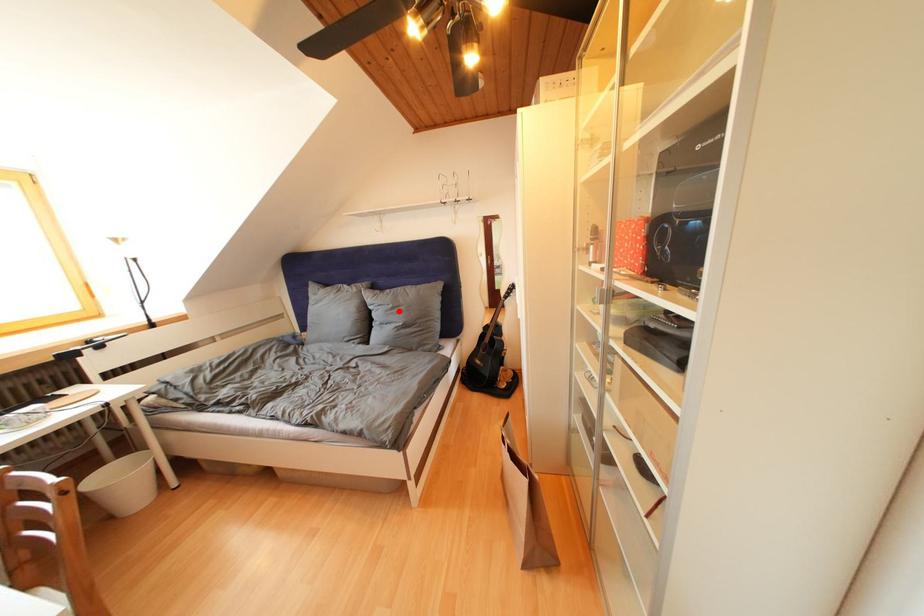
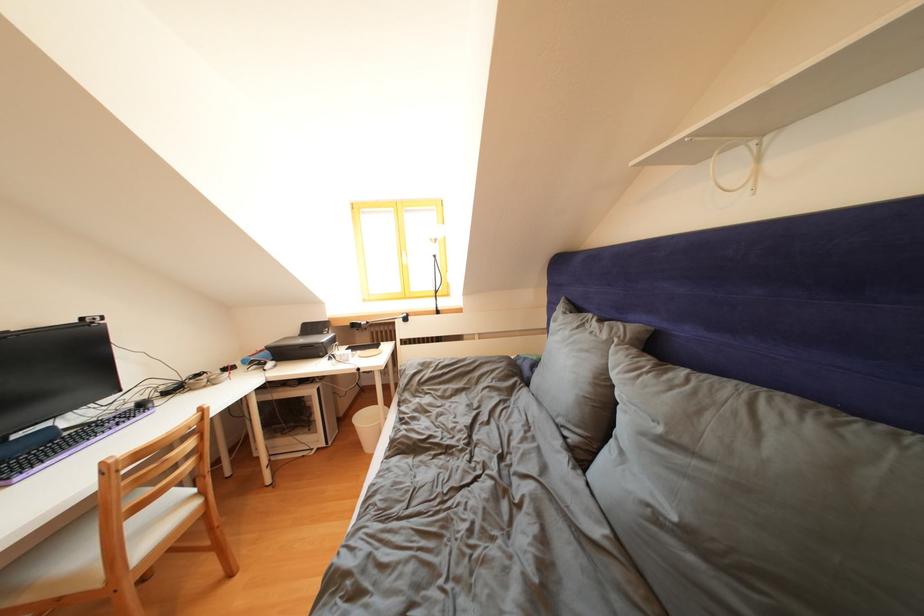
Question: I am providing you with two images of the same scene from different viewpoints. In image1, a red point is highlighted. Considering the same 3D point in image2, which of the following is correct?

Choices:
 (A) It is closer
 (B) It is farther

Answer: (B)